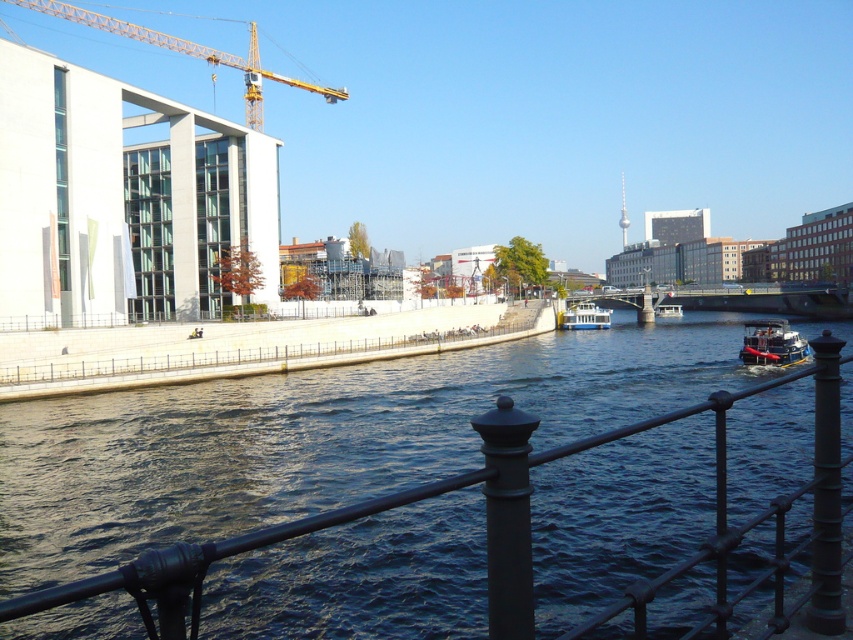
You are standing on the bridge looking down at the river. There is a point marked at coordinates (770, 342). What object is located at this point?

The point at coordinates (770, 342) corresponds to the metallic red boat at right.

You are standing on a bridge overlooking the river and see the yellow metallic crane at upper left and the white plastic boat at center. Which object is located to the left of the other?

The yellow metallic crane at upper left is positioned on the left side of white plastic boat at center.

You are standing on a bridge overlooking the river and see the yellow metallic crane at upper left. If you want to take a photo of it with your camera, which is 3 feet long, will the crane fit in the camera frame? Assume the camera can capture a 60 degree field of view.

The yellow metallic crane at upper left and camera are 250.69 feet apart from each other. Given the distance and the camera field of view, the crane will fit within the frame as the 3 feet length of the camera is sufficient to capture the crane at that distance with a 60 degree angle.